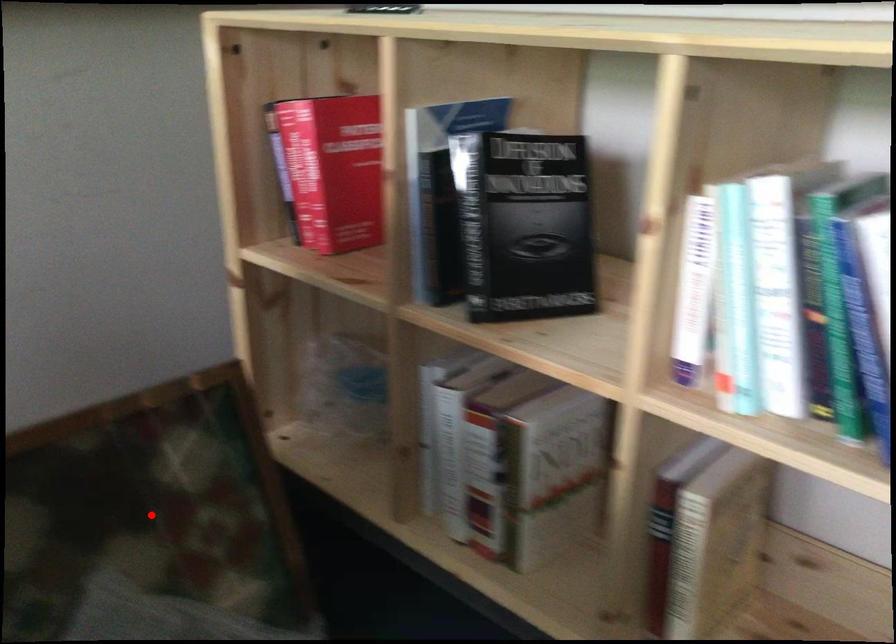
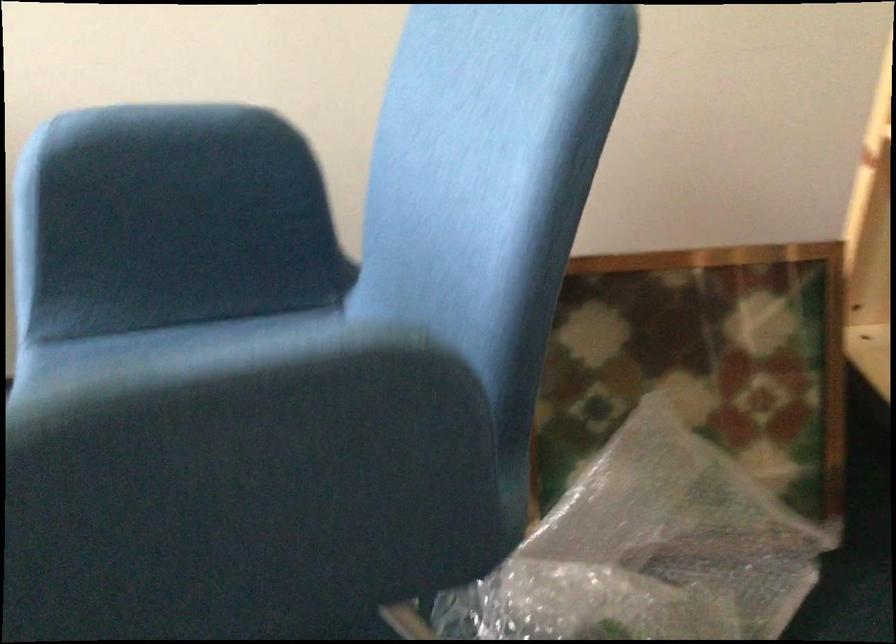
Find the pixel in the second image that matches the highlighted location in the first image.

(702, 363)